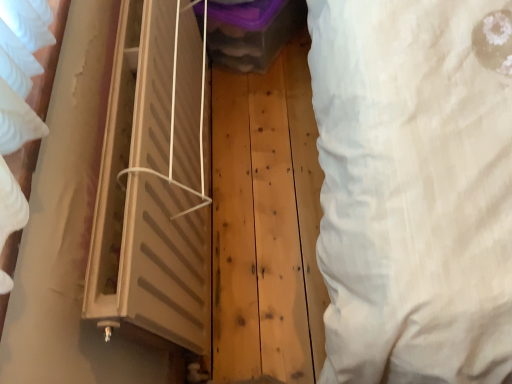
Question: Is beige plastic window at center bigger or smaller than white fabric curtain at right?

Choices:
 (A) big
 (B) small

Answer: (A)

Question: From the image's perspective, is beige plastic window at center positioned above or below white fabric curtain at right?

Choices:
 (A) above
 (B) below

Answer: (B)

Question: In terms of height, does beige plastic window at center look taller or shorter compared to white fabric curtain at right?

Choices:
 (A) tall
 (B) short

Answer: (B)

Question: Considering the positions of point (471, 18) and point (159, 175), is point (471, 18) closer or farther from the camera than point (159, 175)?

Choices:
 (A) farther
 (B) closer

Answer: (B)

Question: Considering the positions of white fabric curtain at right and beige plastic window at center in the image, is white fabric curtain at right wider or thinner than beige plastic window at center?

Choices:
 (A) thin
 (B) wide

Answer: (A)

Question: Visually, is white fabric curtain at right positioned to the left or to the right of beige plastic window at center?

Choices:
 (A) left
 (B) right

Answer: (B)

Question: Relative to beige plastic window at center, is white fabric curtain at right in front or behind?

Choices:
 (A) behind
 (B) front

Answer: (B)